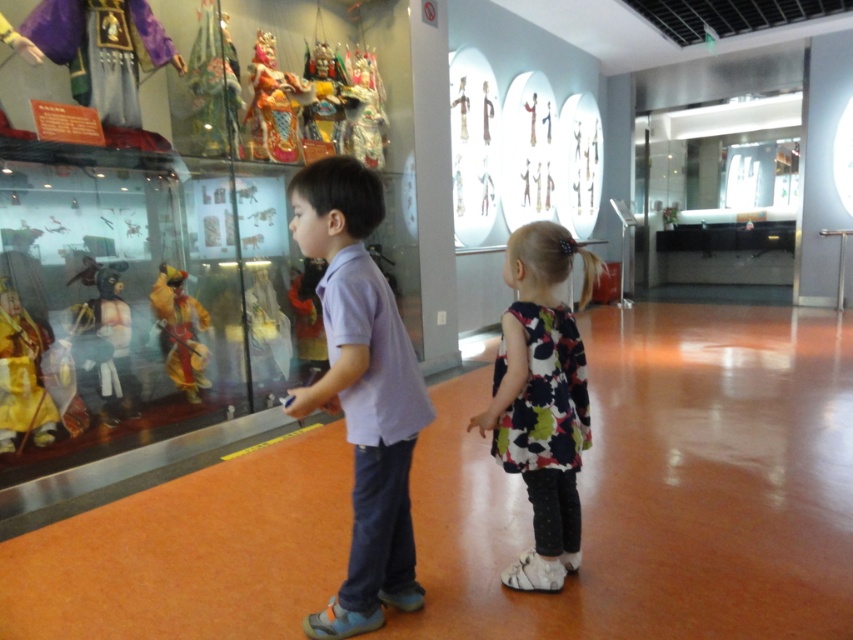
Question: Is purple cotton shirt at center bigger than yellow fabric puppet at left?

Choices:
 (A) yes
 (B) no

Answer: (A)

Question: Which point appears closest to the camera in this image?

Choices:
 (A) (227, 74)
 (B) (274, 125)
 (C) (370, 170)
 (D) (509, 355)

Answer: (C)

Question: Does purple cotton shirt at center appear under matte black mask at left?

Choices:
 (A) yes
 (B) no

Answer: (A)

Question: Which object appears closest to the camera in this image?

Choices:
 (A) shiny gold puppet at upper center
 (B) yellow fabric doll at left
 (C) silk puppet at upper center
 (D) floral fabric dress at center

Answer: (D)

Question: Which point is farther to the camera?

Choices:
 (A) (331, 252)
 (B) (195, 356)
 (C) (218, 65)
 (D) (265, 113)

Answer: (D)

Question: Can you confirm if purple cotton shirt at center is wider than shiny gold puppet at upper center?

Choices:
 (A) no
 (B) yes

Answer: (B)